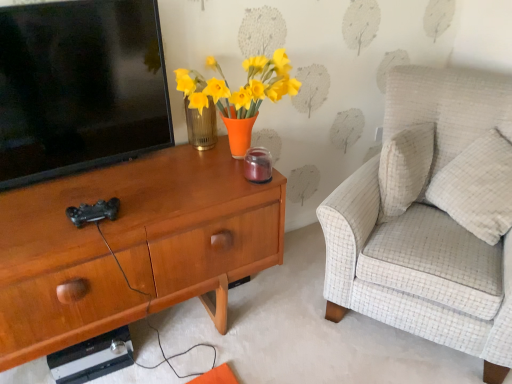
Question: Is black glossy television at left thinner than white textured pillow at right?

Choices:
 (A) no
 (B) yes

Answer: (B)

Question: Is black glossy television at left surrounding white textured pillow at right?

Choices:
 (A) yes
 (B) no

Answer: (B)

Question: Considering the relative sizes of black glossy television at left and white textured pillow at right in the image provided, is black glossy television at left smaller than white textured pillow at right?

Choices:
 (A) yes
 (B) no

Answer: (A)

Question: Does black glossy television at left turn towards white textured pillow at right?

Choices:
 (A) no
 (B) yes

Answer: (A)

Question: Does black glossy television at left have a larger size compared to white textured pillow at right?

Choices:
 (A) yes
 (B) no

Answer: (B)

Question: From the image's perspective, is black glossy television at left over white textured pillow at right?

Choices:
 (A) yes
 (B) no

Answer: (A)

Question: Considering the relative sizes of white textured pillow at right and light beige fabric armchair at right in the image provided, is white textured pillow at right shorter than light beige fabric armchair at right?

Choices:
 (A) yes
 (B) no

Answer: (A)

Question: Considering the relative positions of white textured pillow at right and light beige fabric armchair at right in the image provided, is white textured pillow at right to the left of light beige fabric armchair at right from the viewer's perspective?

Choices:
 (A) no
 (B) yes

Answer: (A)

Question: Does white textured pillow at right lie in front of light beige fabric armchair at right?

Choices:
 (A) no
 (B) yes

Answer: (A)

Question: Would you say white textured pillow at right contains light beige fabric armchair at right?

Choices:
 (A) no
 (B) yes

Answer: (A)

Question: Is white textured pillow at right bigger than light beige fabric armchair at right?

Choices:
 (A) yes
 (B) no

Answer: (B)

Question: Would you say white textured pillow at right is outside light beige fabric armchair at right?

Choices:
 (A) no
 (B) yes

Answer: (A)

Question: Is light beige fabric armchair at right positioned beyond the bounds of woodendesk at left?

Choices:
 (A) no
 (B) yes

Answer: (B)